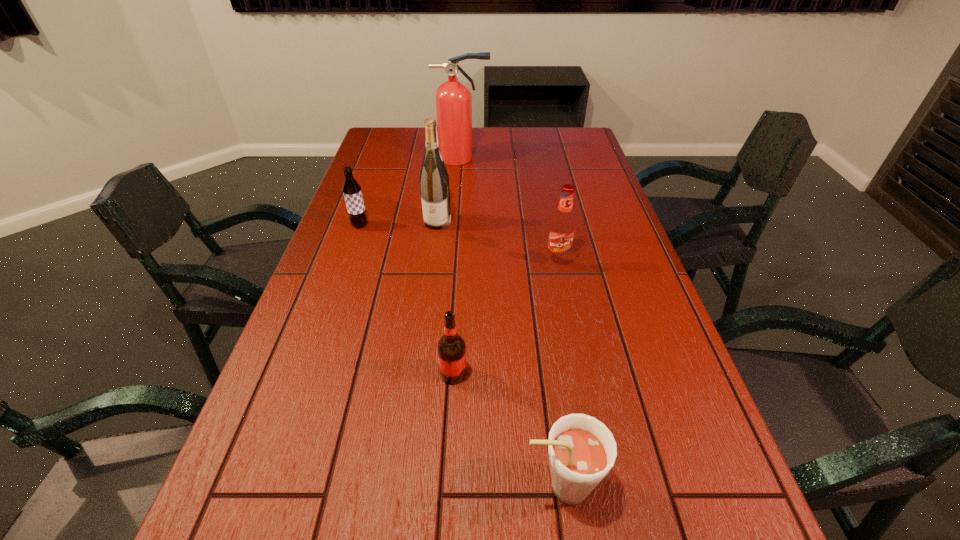
In the image, there is a desktop. Identify the location of blank space at the left edge. The width and height of the screenshot is (960, 540). (300, 440).

The width and height of the screenshot is (960, 540). I want to click on vacant space at the right edge of the desktop, so click(664, 459).

Image resolution: width=960 pixels, height=540 pixels. I want to click on free location at the far left corner of the desktop, so click(396, 127).

Locate an element on the screen. The image size is (960, 540). vacant point at the far right corner is located at coordinates (582, 136).

Identify the location of vacant area that lies between the nearest object and the fire extinguisher. The width and height of the screenshot is (960, 540). (512, 322).

Image resolution: width=960 pixels, height=540 pixels. Identify the location of vacant region between the leftmost root beer and the fire extinguisher. (411, 192).

This screenshot has width=960, height=540. I want to click on vacant area that lies between the fifth farthest object and the nearest root beer, so click(x=507, y=430).

The image size is (960, 540). I want to click on free space between the third nearest root beer and the nearest root beer, so click(x=559, y=373).

Find the location of a particular element. This screenshot has height=540, width=960. vacant point located between the farthest object and the nearest object is located at coordinates (512, 322).

Locate an element on the screen. This screenshot has width=960, height=540. vacant space in between the third root beer from right to left and the wine bottle is located at coordinates (445, 298).